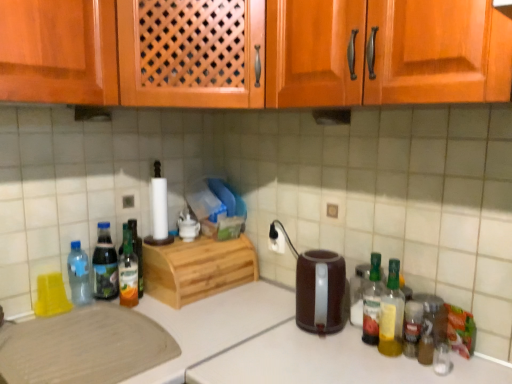
Question: Does point (227, 246) appear closer or farther from the camera than point (97, 225)?

Choices:
 (A) farther
 (B) closer

Answer: (A)

Question: Is natural wood breadbox at center, placed as the 2th cabinetry when sorted from top to bottom, spatially inside translucent plastic bottle at left, which is counted as the 5th bottle, starting from the right, or outside of it?

Choices:
 (A) outside
 (B) inside

Answer: (A)

Question: Which of these objects is positioned closest to the light brown wood cutting board at lower left?

Choices:
 (A) brown plastic kettle at center
 (B) wooden cabinet at upper center, which ranks as the 1th cabinetry in top-to-bottom order
 (C) translucent glass bottle at right, arranged as the 2th bottle when viewed from the right
 (D) transparent plastic bottle at left, which ranks as the 1th bottle in left-to-right order
 (E) translucent glass bottle at center left, which is counted as the third bottle, starting from the left

Answer: (E)

Question: Estimate the real-world distances between objects in this image. Which object is closer to the translucent glass bottle at right, the third bottle from the right?

Choices:
 (A) transparent plastic bottle at left, the sixth bottle when ordered from right to left
 (B) translucent glass bottle at center left, which is the 4th bottle from right to left
 (C) translucent glass bottle at right, arranged as the 2th bottle when viewed from the right
 (D) translucent plastic bottle at right, the sixth bottle viewed from the left
 (E) natural wood breadbox at center, placed as the 2th cabinetry when sorted from top to bottom

Answer: (C)